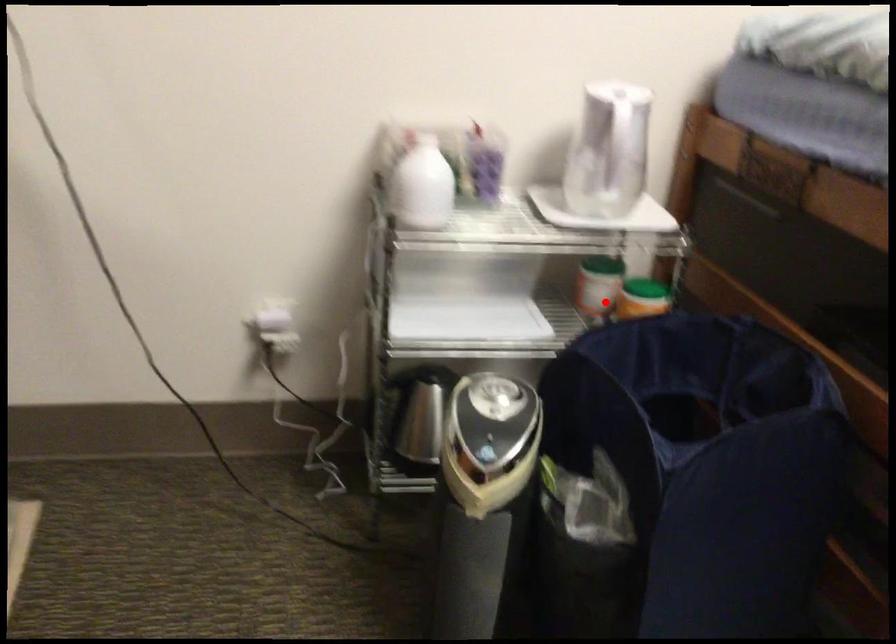
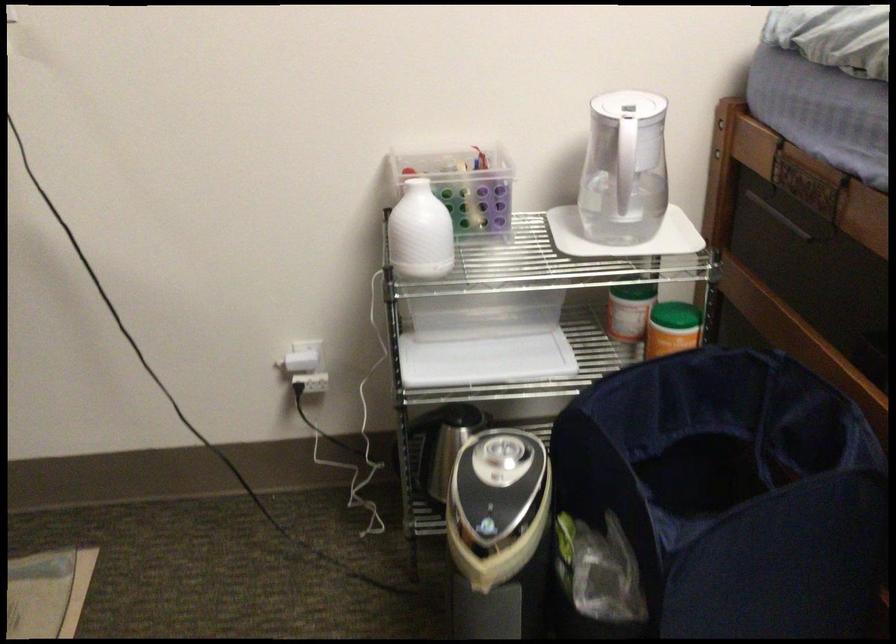
In the second image, find the point that corresponds to the highlighted location in the first image.

(635, 325)